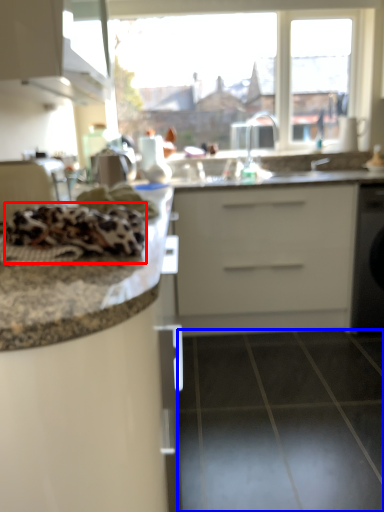
Question: Which object appears farthest to the camera in this image, material (highlighted by a red box) or tile (highlighted by a blue box)?

Choices:
 (A) material
 (B) tile

Answer: (B)